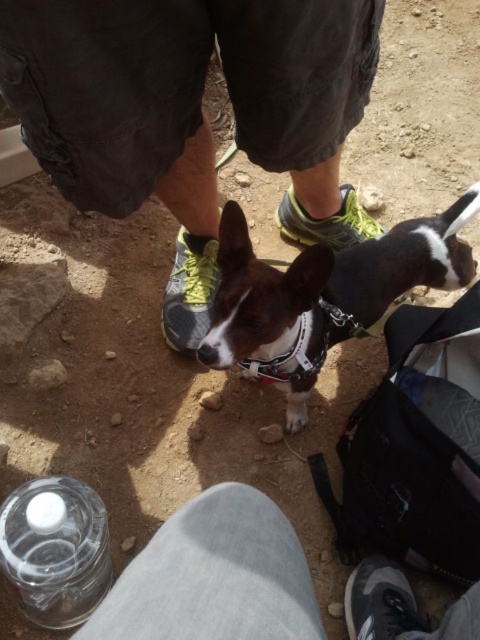
You are trying to decide whether to step forward to pet the brown matte dog at center. Your gray mesh shoe at center is already on the ground. Will your shoe be in front of or behind the dog when you step forward?

The brown matte dog at center is closer to the viewer than the gray mesh shoe at center. When you step forward, your gray mesh shoe at center will be behind the dog because the dog is already closer to you.